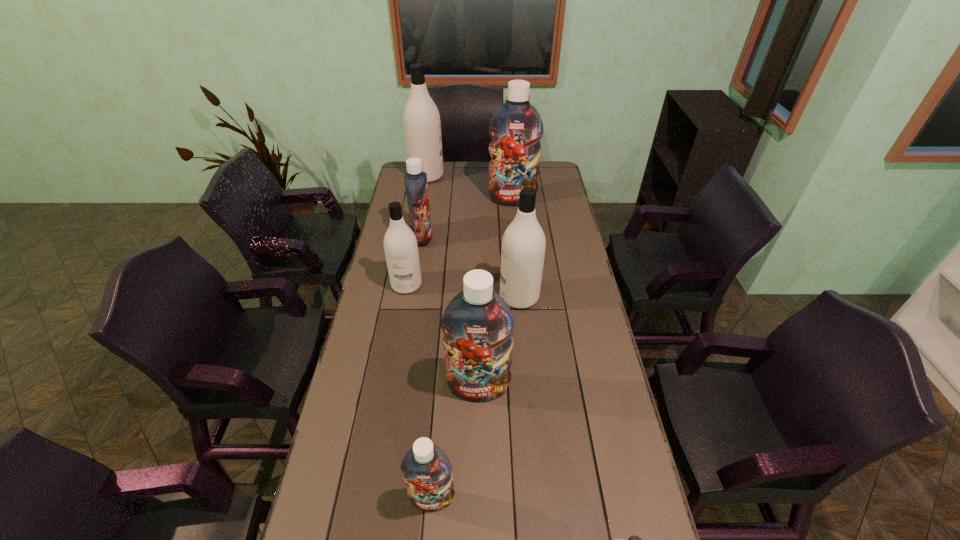
This screenshot has height=540, width=960. In order to click on the smallest blue shampoo in this screenshot , I will do `click(426, 469)`.

What are the coordinates of `the second nearest object` in the screenshot? It's located at tap(426, 469).

What are the coordinates of `vacant space located on the front-facing side of the farthest shampoo` in the screenshot? It's located at (507, 176).

This screenshot has width=960, height=540. Identify the location of blank space located 0.090m on the front label of the farthest blue shampoo. (514, 218).

Find the location of a particular element. vacant space situated on the front-facing side of the third white shampoo from left to right is located at coordinates (444, 296).

I want to click on free region located on the front-facing side of the third white shampoo from left to right, so click(x=486, y=296).

Identify the location of vacant area situated on the front-facing side of the third white shampoo from left to right. (429, 296).

Identify the location of vacant space located 0.180m on the front label of the third farthest blue shampoo. The width and height of the screenshot is (960, 540). (478, 463).

The width and height of the screenshot is (960, 540). What are the coordinates of `free spot located on the front label of the sixth nearest object` in the screenshot? It's located at (526, 238).

Image resolution: width=960 pixels, height=540 pixels. Find the location of `vacant position located 0.230m on the front-facing side of the third biggest white shampoo`. vacant position located 0.230m on the front-facing side of the third biggest white shampoo is located at coordinates (396, 345).